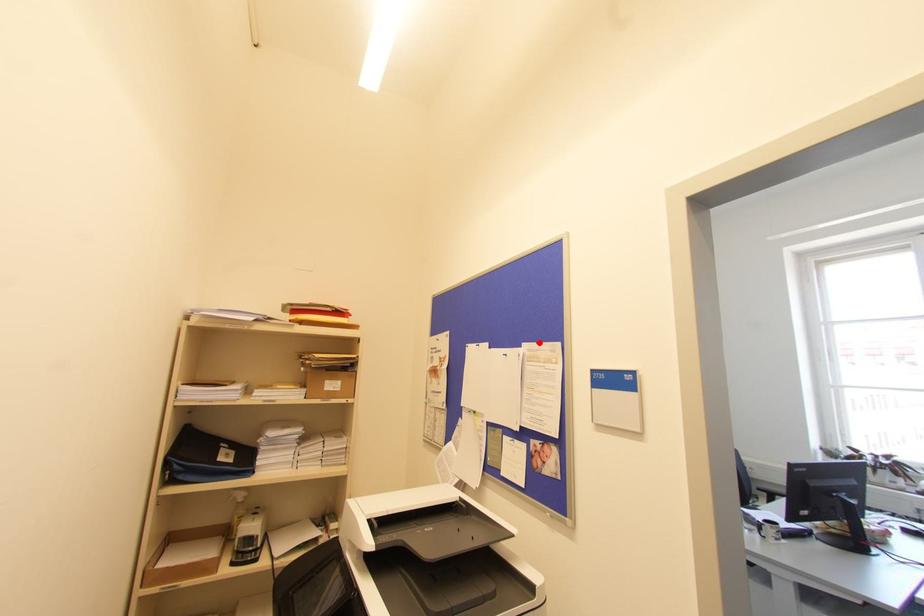
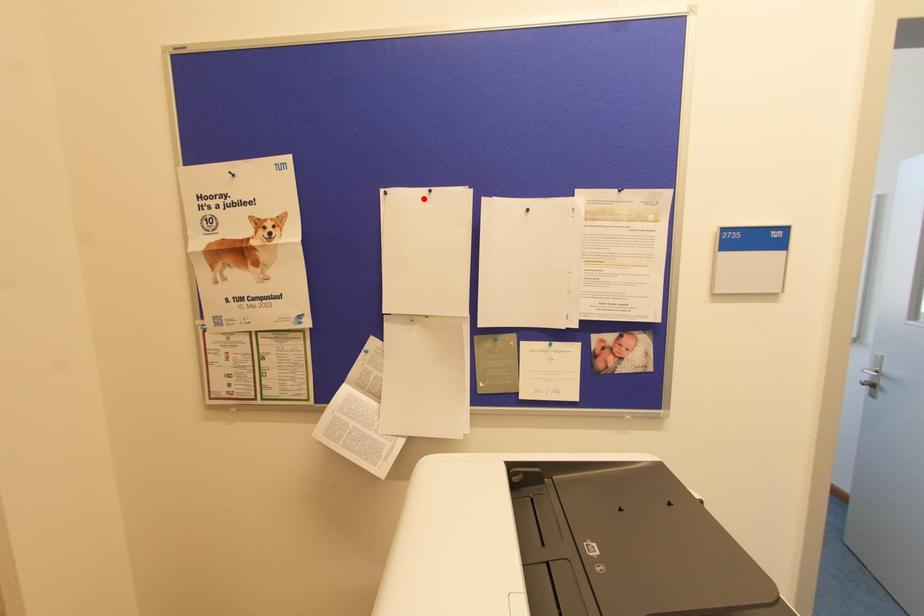
I am providing you with two images of the same scene from different viewpoints. A red point is marked on the first image and another point is marked on the second image. Do the highlighted points in image1 and image2 indicate the same real-world spot?

No